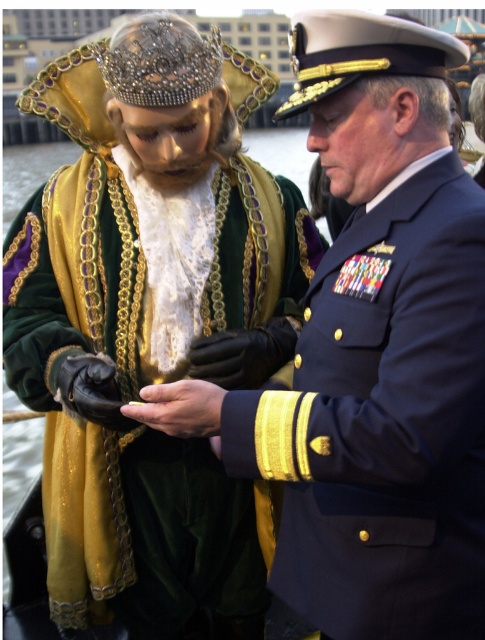
Question: Which of these objects is positioned closest to the navy blue uniform at center?

Choices:
 (A) shiny blue uniform at center
 (B) matte black hand at center

Answer: (B)

Question: In this image, where is shiny blue uniform at center located relative to navy blue uniform at center?

Choices:
 (A) left
 (B) right

Answer: (A)

Question: Does shiny blue uniform at center appear over matte black hand at center?

Choices:
 (A) yes
 (B) no

Answer: (A)

Question: Which point appears closest to the camera in this image?

Choices:
 (A) (189, 412)
 (B) (319, 40)
 (C) (80, 483)

Answer: (A)

Question: Which point is farther from the camera taking this photo?

Choices:
 (A) (381, 387)
 (B) (183, 403)
 (C) (94, 605)

Answer: (C)

Question: Does shiny blue uniform at center come in front of navy blue uniform at center?

Choices:
 (A) no
 (B) yes

Answer: (A)